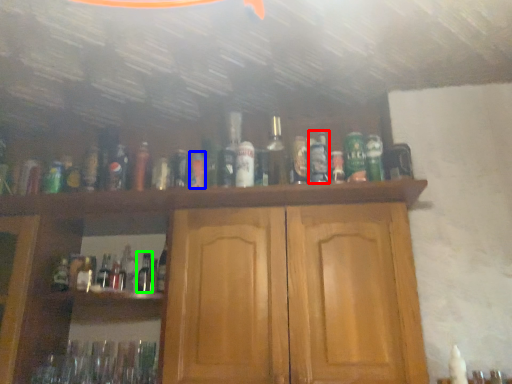
Question: Considering the real-world distances, which object is farthest from bottle (highlighted by a red box)? bottle (highlighted by a blue box) or bottle (highlighted by a green box)?

Choices:
 (A) bottle
 (B) bottle

Answer: (B)